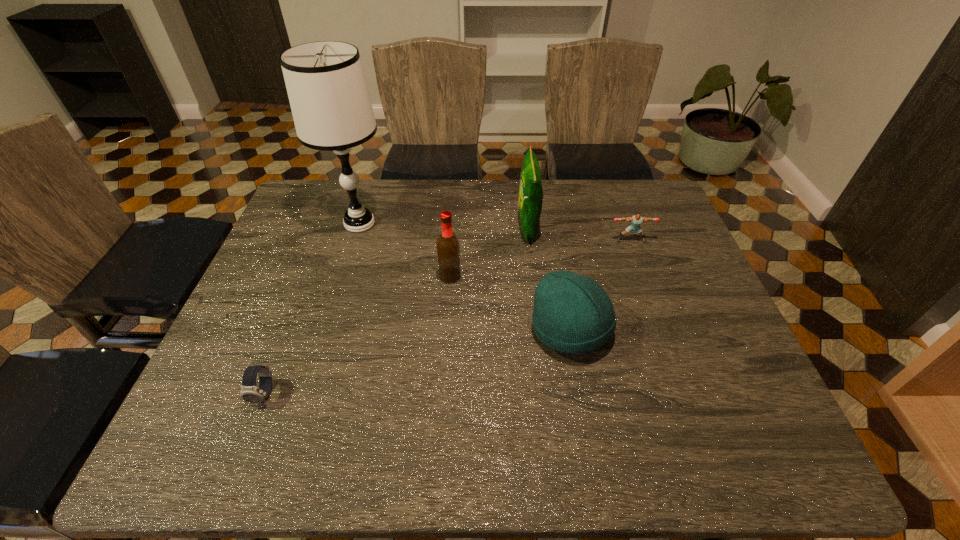
You are a GUI agent. You are given a task and a screenshot of the screen. Output one action in this format:
    pyautogui.click(x=<x>, y=<y>)
    Task: Click on the vacant point located between the crisp (potato chip) and the beer bottle
    This screenshot has height=540, width=960.
    Given the screenshot: What is the action you would take?
    pyautogui.click(x=489, y=252)

At what (x,y) coordinates should I click in order to perform the action: click on vacant space that's between the second nearest object and the third object from left to right. Please return your answer as a coordinate pair (x, y). Looking at the image, I should click on (511, 303).

Locate an element on the screen. The image size is (960, 540). free space between the table lamp and the third nearest object is located at coordinates (405, 250).

In order to click on vacant area between the beer bottle and the rightmost object in this screenshot , I will do `click(540, 258)`.

Find the location of a particular element. The height and width of the screenshot is (540, 960). free point between the third object from left to right and the beanie is located at coordinates (511, 303).

This screenshot has width=960, height=540. Find the location of `vacant area that lies between the tallest object and the third object from left to right`. vacant area that lies between the tallest object and the third object from left to right is located at coordinates (405, 250).

What are the coordinates of `unoccupied area between the shortest object and the rightmost object` in the screenshot? It's located at [447, 317].

This screenshot has width=960, height=540. Identify the location of free space between the beanie and the beer bottle. (511, 303).

Where is `empty location between the puncher and the tallest object`? The width and height of the screenshot is (960, 540). empty location between the puncher and the tallest object is located at coordinates (495, 232).

Image resolution: width=960 pixels, height=540 pixels. I want to click on object that can be found as the fifth closest to the rightmost object, so click(x=250, y=392).